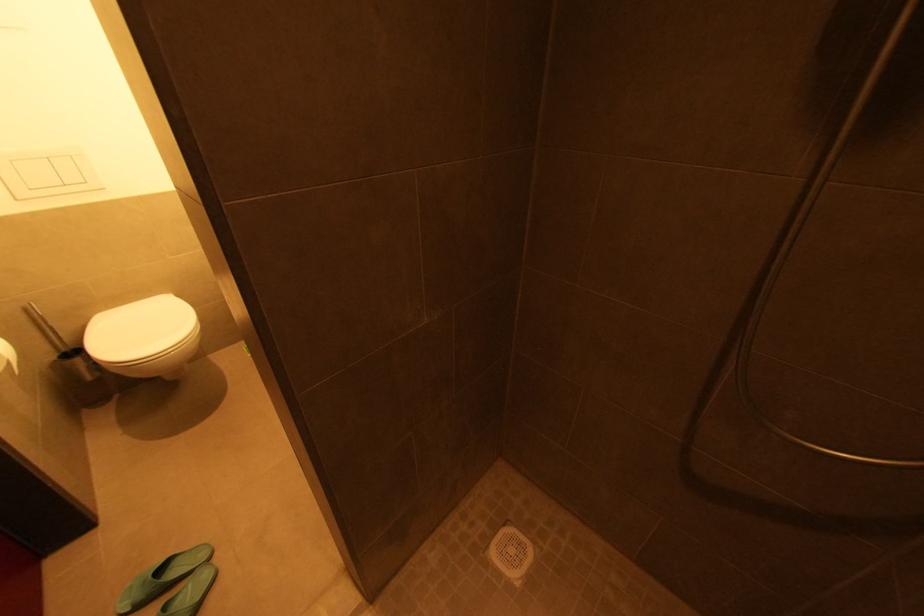
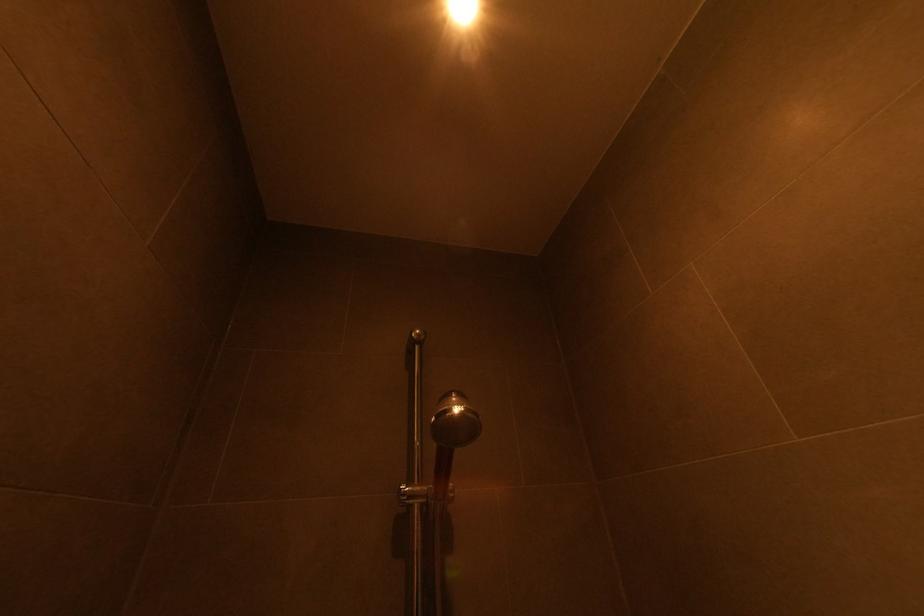
Based on the continuous images, in which direction is the camera rotating?

The camera rotated toward right-up.